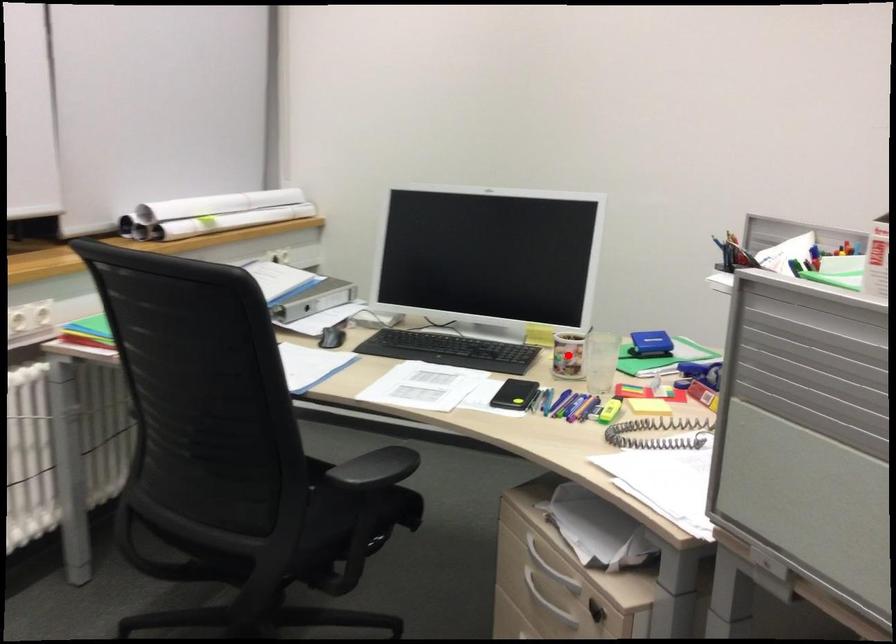
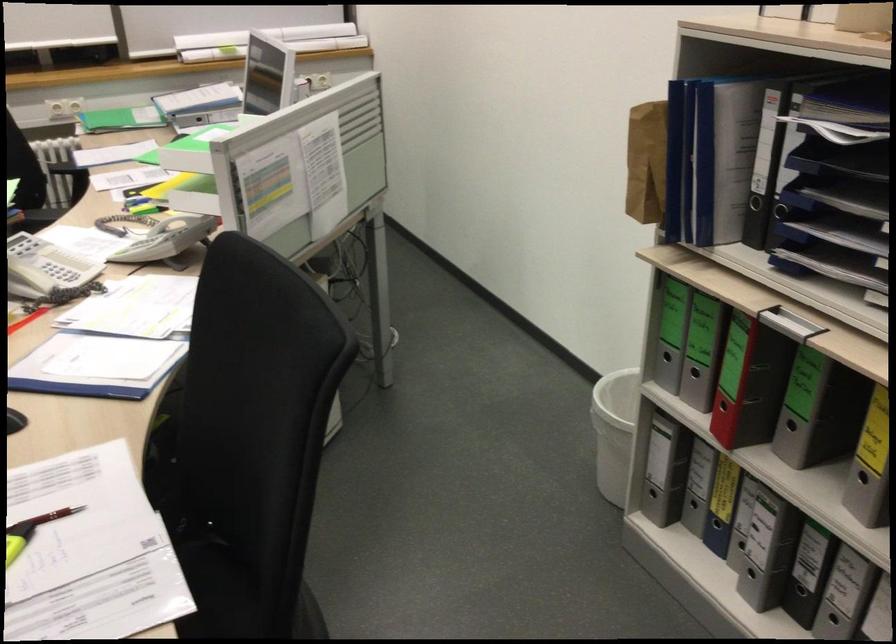
Question: I am providing you with two images of the same scene from different viewpoints. A red point is marked on the first image. Can you still see the location of the red point in image 2?

Choices:
 (A) Yes
 (B) No

Answer: (B)